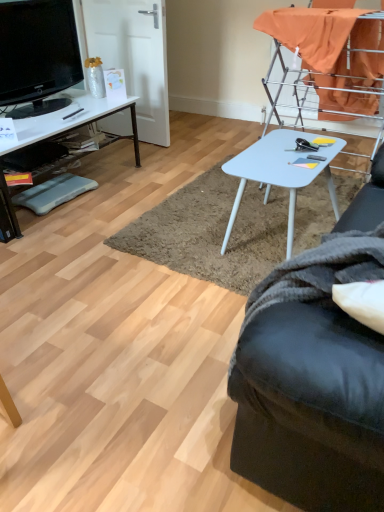
Question: In the image, is black plastic pen at left on the left side or the right side of black fabric studio couch at lower right?

Choices:
 (A) right
 (B) left

Answer: (B)

Question: Is point (69, 113) positioned closer to the camera than point (279, 457)?

Choices:
 (A) farther
 (B) closer

Answer: (A)

Question: Estimate the real-world distances between objects in this image. Which object is closer to the black plastic pen at left?

Choices:
 (A) blue foam footrest at lower left
 (B) white glossy desk at left
 (C) white plastic table at center
 (D) light blue plastic table at center
 (E) black glossy television at upper left

Answer: (B)

Question: Which is farther from the black glossy television at upper left?

Choices:
 (A) black plastic pen at left
 (B) white plastic table at center
 (C) light blue plastic table at center
 (D) black fabric studio couch at lower right
 (E) white glossy desk at left

Answer: (D)